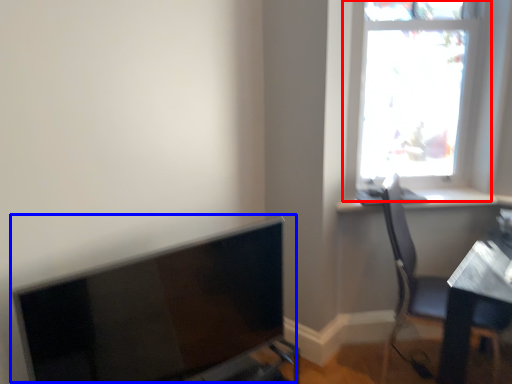
Question: Which of the following is the farthest to the observer, window (highlighted by a red box) or computer monitor (highlighted by a blue box)?

Choices:
 (A) window
 (B) computer monitor

Answer: (A)